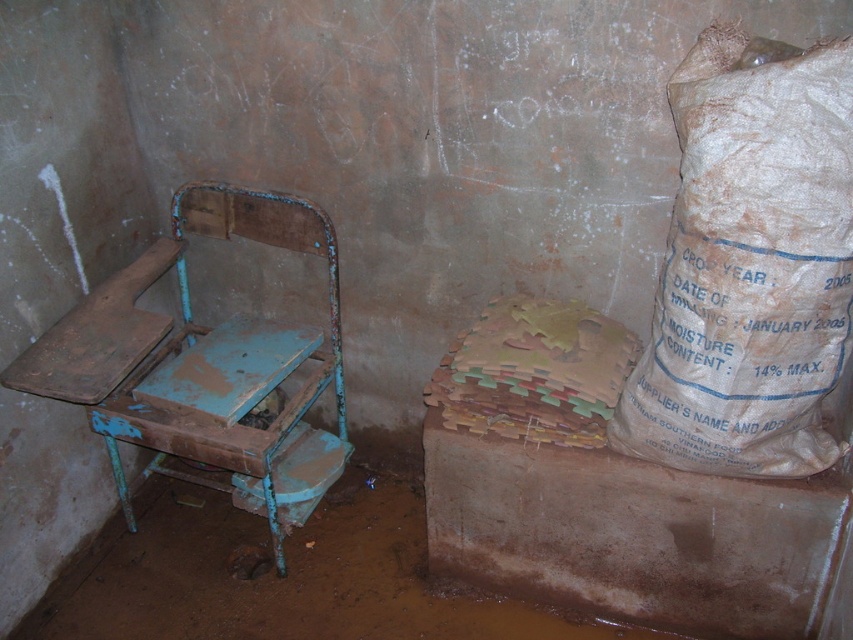
Question: Is brown paper sack at upper right wider than rusty metal chair at left?

Choices:
 (A) no
 (B) yes

Answer: (A)

Question: Does brown paper sack at upper right appear over rusty metal chair at left?

Choices:
 (A) no
 (B) yes

Answer: (B)

Question: Which object appears farthest from the camera in this image?

Choices:
 (A) brown paper sack at upper right
 (B) rusty metal chair at left

Answer: (B)

Question: Does brown paper sack at upper right appear under rusty metal chair at left?

Choices:
 (A) yes
 (B) no

Answer: (B)